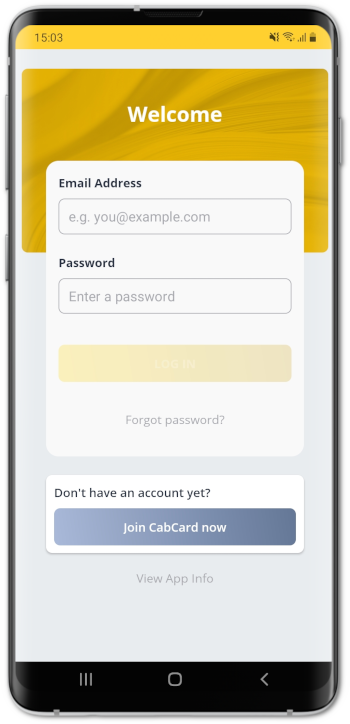
Where is `wifi`? The width and height of the screenshot is (350, 724). wifi is located at coordinates click(286, 35).